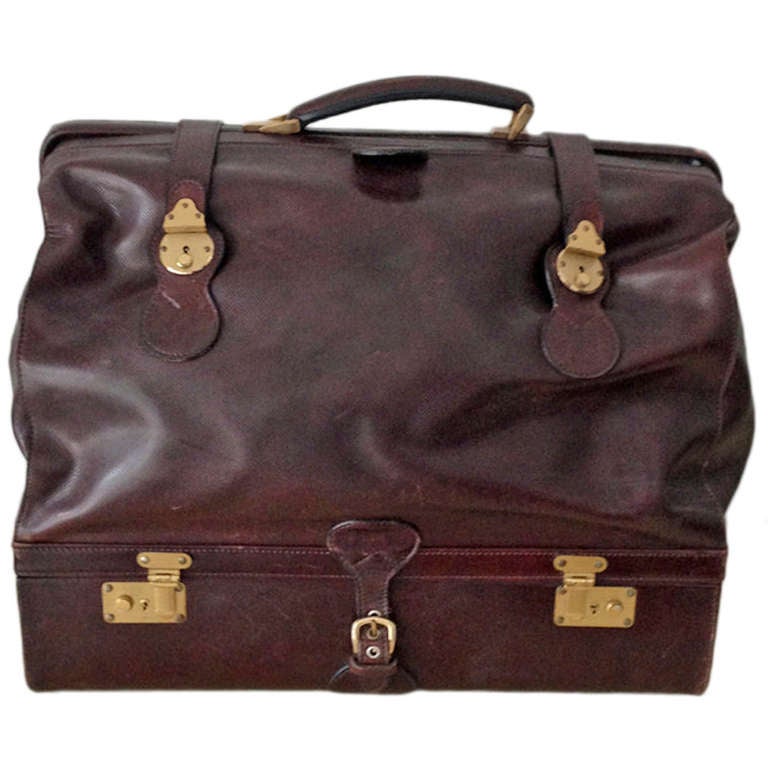
At what (x,y) coordinates should I click in order to perform the action: click on grommet. Please return your answer as a coordinate pair (x, y). Looking at the image, I should click on (369, 657).